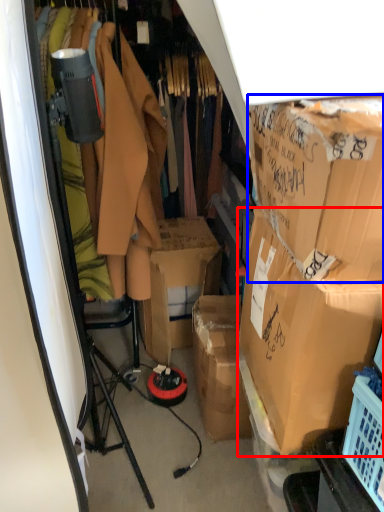
Question: Which point is closer to the camera, box (highlighted by a red box) or box (highlighted by a blue box)?

Choices:
 (A) box
 (B) box

Answer: (B)